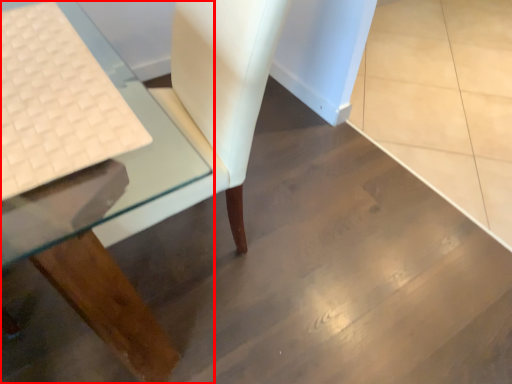
Question: Considering the relative positions of table (annotated by the red box) and laptop keyboard in the image provided, where is table (annotated by the red box) located with respect to the staircase?

Choices:
 (A) right
 (B) left

Answer: (A)